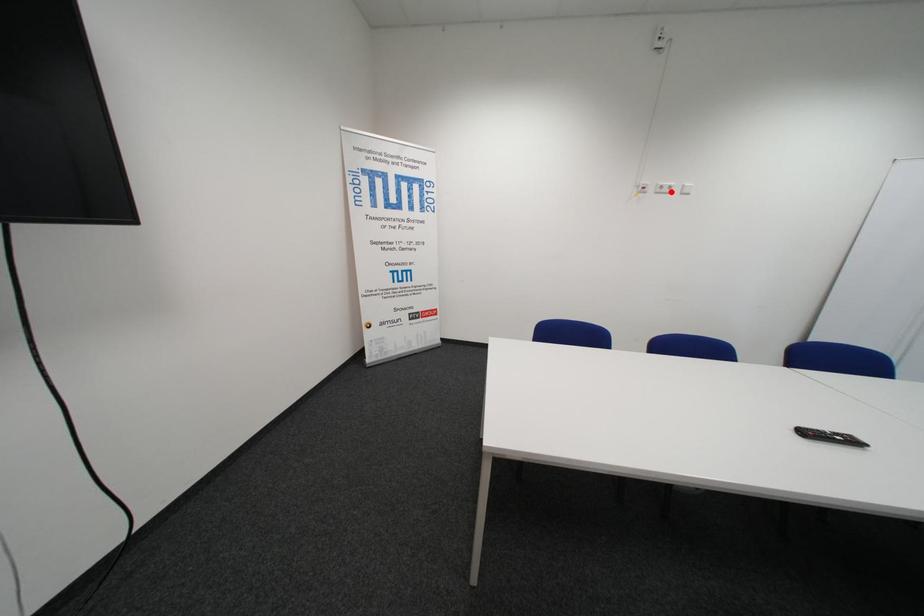
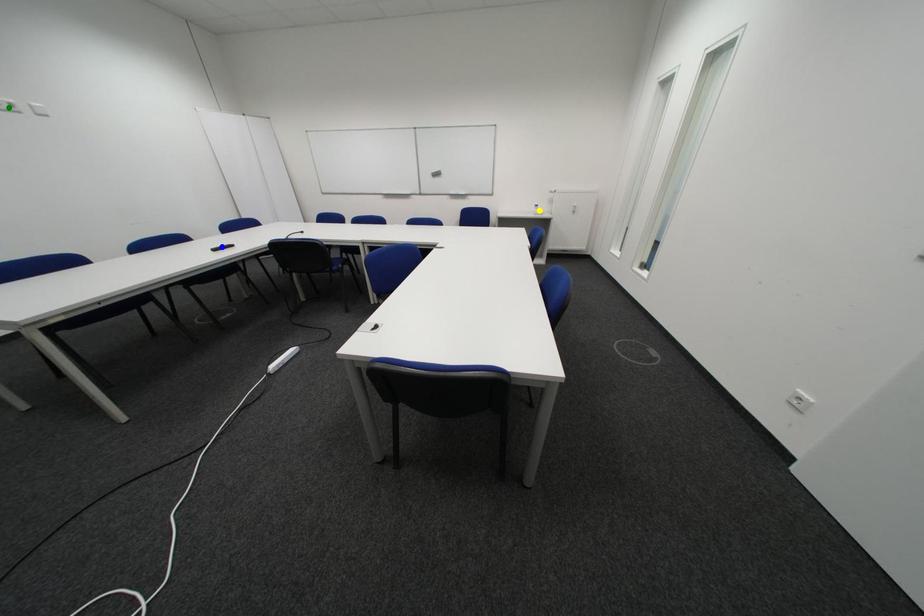
Question: I am providing you with two images of the same scene from different viewpoints. A red point is marked on the first image. You are given multiple points on the second image. In image 2, which mark is for the same physical point as the one in image 1?

Choices:
 (A) yellow point
 (B) blue point
 (C) green point

Answer: (C)